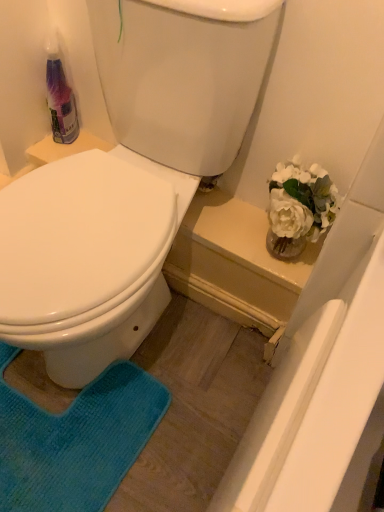
Question: Is blue textured rug at lower left thinner than white glossy toilet at center?

Choices:
 (A) yes
 (B) no

Answer: (A)

Question: From the image's perspective, is blue textured rug at lower left under white glossy toilet at center?

Choices:
 (A) no
 (B) yes

Answer: (B)

Question: From a real-world perspective, does blue textured rug at lower left sit lower than white glossy toilet at center?

Choices:
 (A) no
 (B) yes

Answer: (B)

Question: Is blue textured rug at lower left touching white glossy toilet at center?

Choices:
 (A) no
 (B) yes

Answer: (A)

Question: Is blue textured rug at lower left to the right of white glossy toilet at center from the viewer's perspective?

Choices:
 (A) no
 (B) yes

Answer: (A)

Question: Is blue textured rug at lower left to the left of white glossy toilet at center from the viewer's perspective?

Choices:
 (A) no
 (B) yes

Answer: (B)

Question: Are translucent plastic bottle at upper left and white glossy toilet at center beside each other?

Choices:
 (A) no
 (B) yes

Answer: (A)

Question: Does translucent plastic bottle at upper left have a greater width compared to white glossy toilet at center?

Choices:
 (A) yes
 (B) no

Answer: (B)

Question: From a real-world perspective, is translucent plastic bottle at upper left on top of white glossy toilet at center?

Choices:
 (A) no
 (B) yes

Answer: (B)

Question: Is translucent plastic bottle at upper left far from white glossy toilet at center?

Choices:
 (A) yes
 (B) no

Answer: (B)

Question: Can you confirm if translucent plastic bottle at upper left is thinner than white glossy toilet at center?

Choices:
 (A) no
 (B) yes

Answer: (B)

Question: Is translucent plastic bottle at upper left further to the viewer compared to white glossy toilet at center?

Choices:
 (A) no
 (B) yes

Answer: (B)

Question: Can you confirm if white glossy toilet at center is thinner than translucent plastic bottle at upper left?

Choices:
 (A) no
 (B) yes

Answer: (A)